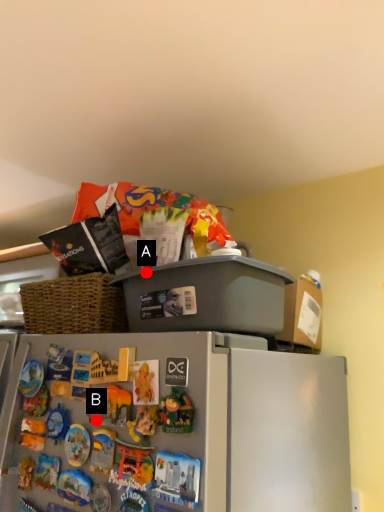
Question: Two points are circled on the image, labeled by A and B beside each circle. Which point is further to the camera?

Choices:
 (A) A is further
 (B) B is further

Answer: (A)